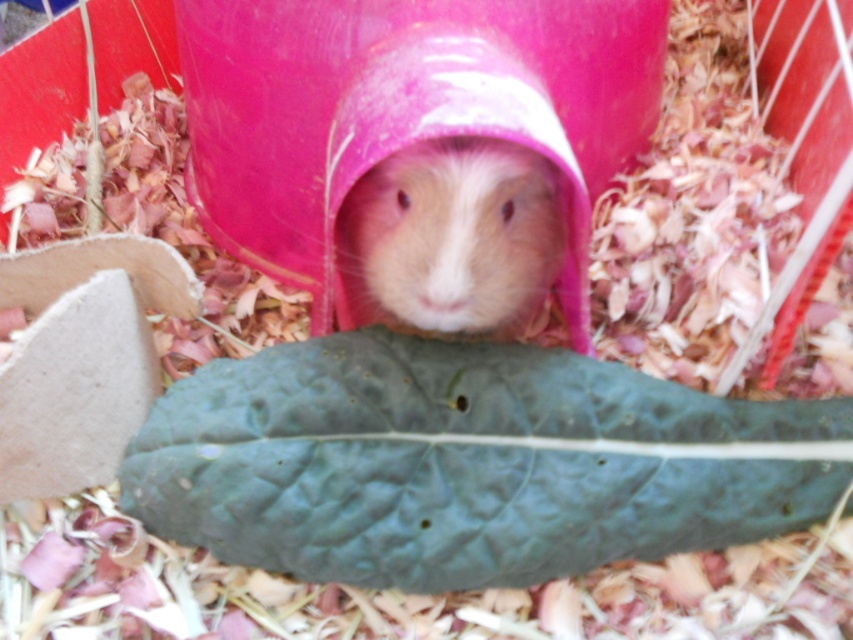
Which is more to the left, green matte leaf at center or fuzzy pink hamster at center?

fuzzy pink hamster at center is more to the left.

Who is higher up, green matte leaf at center or fuzzy pink hamster at center?

fuzzy pink hamster at center

Is point (225, 406) in front of point (525, 291)?

Yes, it is.

At what (x,y) coordinates should I click in order to perform the action: click on green matte leaf at center. Please return your answer as a coordinate pair (x, y). Looking at the image, I should click on (468, 461).

Who is more forward, (328, 51) or (463, 241)?

Positioned in front is point (463, 241).

Locate an element on the screen. light brown fur hamster at center is located at coordinates (402, 109).

Is point (532, 356) closer to camera compared to point (190, 156)?

Yes, it is in front of point (190, 156).

Does green matte leaf at center come behind light brown fur hamster at center?

Yes, it is behind light brown fur hamster at center.

Does point (331, 422) lie in front of point (297, 140)?

Yes, point (331, 422) is in front of point (297, 140).

You are a GUI agent. You are given a task and a screenshot of the screen. Output one action in this format:
    pyautogui.click(x=<x>, y=<y>)
    Task: Click on the green matte leaf at center
    The height and width of the screenshot is (640, 853).
    Given the screenshot: What is the action you would take?
    468,461